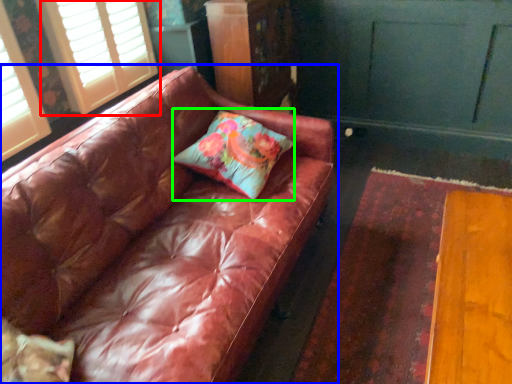
Question: Which is farther away from window (highlighted by a red box)? studio couch (highlighted by a blue box) or pillow (highlighted by a green box)?

Choices:
 (A) studio couch
 (B) pillow

Answer: (B)